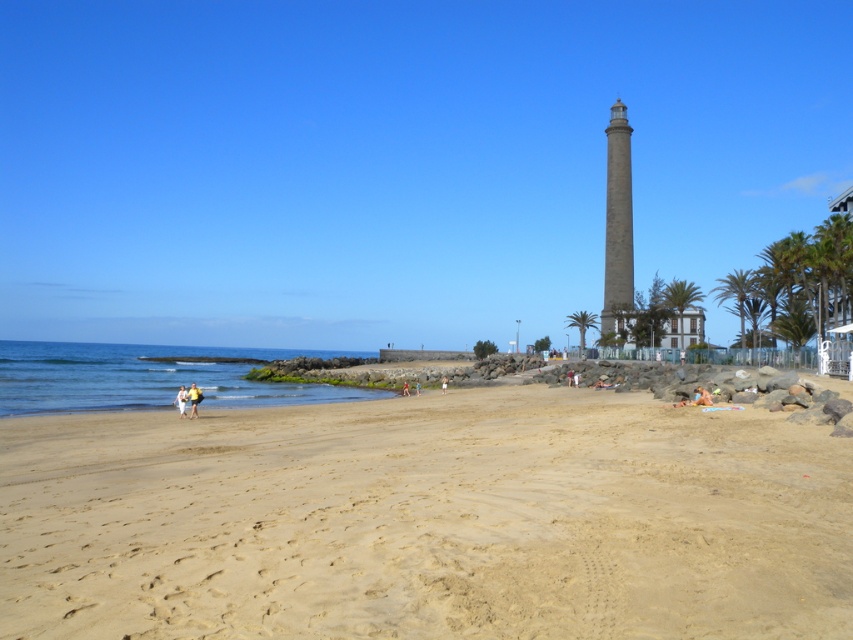
Can you confirm if green leafy palm tree at center is positioned above yellow fabric at lower left?

Yes.

From the picture: Which of these two, green leafy palm tree at center or yellow fabric at lower left, stands taller?

Standing taller between the two is green leafy palm tree at center.

Between point (590, 326) and point (192, 410), which one is positioned in front?

Point (192, 410)

Find the location of `green leafy palm tree at center`. green leafy palm tree at center is located at coordinates (581, 324).

Is green leafy palm tree at right thinner than green leafy palm tree at center?

In fact, green leafy palm tree at right might be wider than green leafy palm tree at center.

Consider the image. Can you confirm if green leafy palm tree at right is positioned to the left of green leafy palm tree at center?

No, green leafy palm tree at right is not to the left of green leafy palm tree at center.

Is point (714, 292) farther from viewer compared to point (576, 323)?

That is False.

Where is `green leafy palm tree at right`? green leafy palm tree at right is located at coordinates (735, 294).

Which is below, beige sand at lower right or white fabric at lower left?

white fabric at lower left is below.

Is beige sand at lower right thinner than white fabric at lower left?

Indeed, beige sand at lower right has a lesser width compared to white fabric at lower left.

Is point (682, 404) more distant than point (186, 394)?

No, it is not.

Locate an element on the screen. beige sand at lower right is located at coordinates (695, 397).